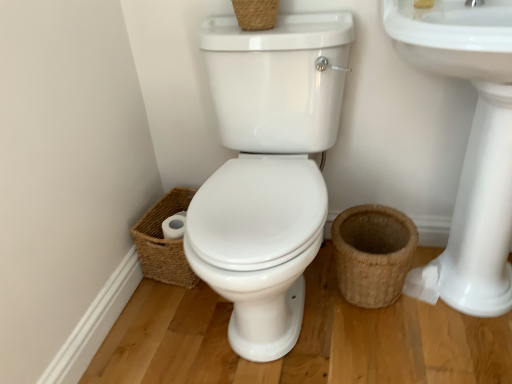
The height and width of the screenshot is (384, 512). In order to click on unoccupied region to the right of brown woven basket at lower right, which ranks as the 3th basket in top-to-bottom order in this screenshot , I will do `click(447, 306)`.